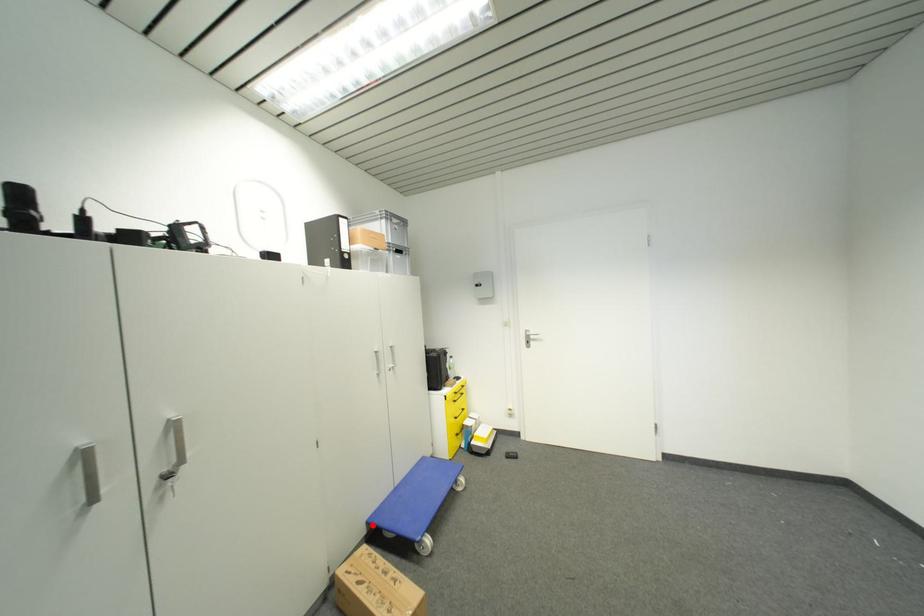
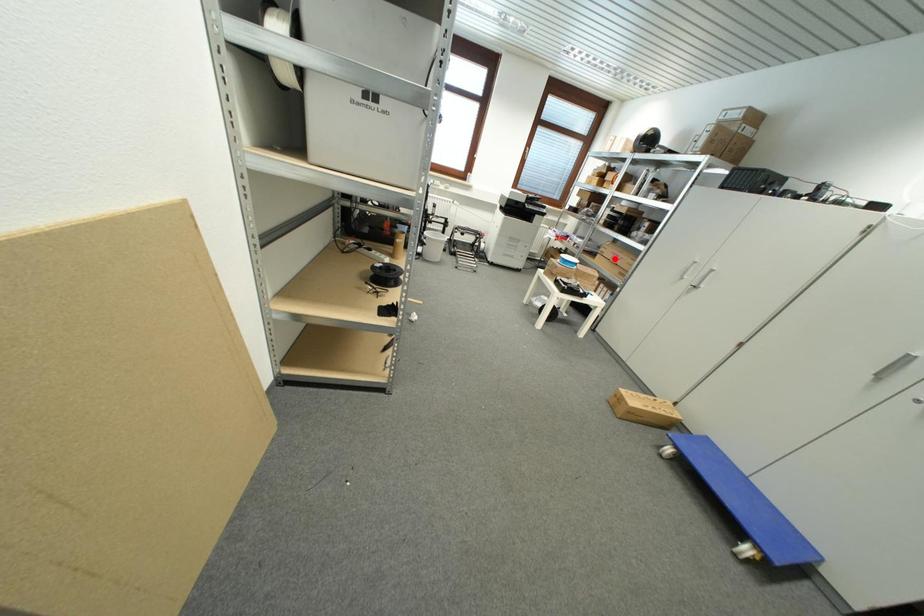
I am providing you with two images of the same scene from different viewpoints. A red point is marked on the first image and another point is marked on the second image. Is the red point in image1 aligned with the point shown in image2?

No